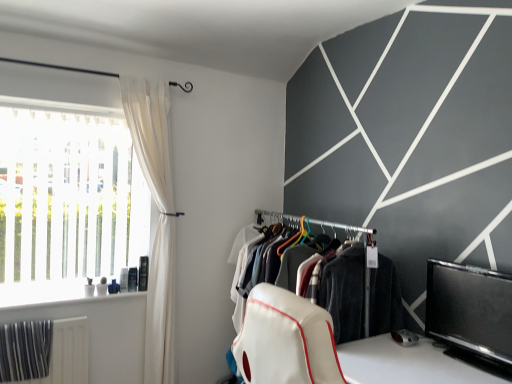
The height and width of the screenshot is (384, 512). Describe the element at coordinates (355, 285) in the screenshot. I see `white fabric clothes at center` at that location.

At what (x,y) coordinates should I click in order to perform the action: click on white translucent blinds at left. Please return your answer as a coordinate pair (x, y). This screenshot has width=512, height=384. Looking at the image, I should click on (67, 200).

At what (x,y) coordinates should I click in order to perform the action: click on black glossy tv at lower right. Please return your answer as a coordinate pair (x, y). The image size is (512, 384). Looking at the image, I should click on (470, 311).

Where is `white fabric clothes at center`? The width and height of the screenshot is (512, 384). white fabric clothes at center is located at coordinates (355, 285).

Is metallic silver radiator at lower left oriented away from white translucent blinds at left?

No, metallic silver radiator at lower left is not facing away from white translucent blinds at left.

From a real-world perspective, which is physically below, metallic silver radiator at lower left or white translucent blinds at left?

metallic silver radiator at lower left, from a real-world perspective.

Would you say metallic silver radiator at lower left is inside or outside white translucent blinds at left?

The correct answer is: outside.

Is white translucent blinds at left facing away from metallic silver radiator at lower left?

white translucent blinds at left does not have its back to metallic silver radiator at lower left.

Are white translucent blinds at left and metallic silver radiator at lower left far apart?

white translucent blinds at left is near metallic silver radiator at lower left, not far away.

Considering the sizes of objects white translucent blinds at left and metallic silver radiator at lower left in the image provided, who is smaller, white translucent blinds at left or metallic silver radiator at lower left?

Smaller between the two is metallic silver radiator at lower left.

Is white translucent blinds at left taller or shorter than white sheer curtain at left?

Clearly, white translucent blinds at left is shorter compared to white sheer curtain at left.

Is white translucent blinds at left oriented away from white sheer curtain at left?

That's not correct — white translucent blinds at left is not looking away from white sheer curtain at left.

Identify the location of curtain that appears below the white translucent blinds at left (from a real-world perspective). This screenshot has width=512, height=384. (158, 219).

Can you tell me how much white translucent blinds at left and white sheer curtain at left differ in facing direction?

1.3 degrees separate the facing orientations of white translucent blinds at left and white sheer curtain at left.

How many degrees apart are the facing directions of black glossy tv at lower right and metallic silver radiator at lower left?

black glossy tv at lower right and metallic silver radiator at lower left are facing 91.7 degrees away from each other.

From the image's perspective, which is above, black glossy tv at lower right or metallic silver radiator at lower left?

black glossy tv at lower right.

Between black glossy tv at lower right and metallic silver radiator at lower left, which one is positioned in front?

Positioned in front is black glossy tv at lower right.

Is point (493, 355) farther from camera compared to point (66, 322)?

No, (493, 355) is in front of (66, 322).

Is point (340, 328) in front of point (59, 341)?

Yes, it is in front of point (59, 341).

Does white fabric clothes at center lie in front of metallic silver radiator at lower left?

Yes.

The width and height of the screenshot is (512, 384). I want to click on radiator located below the white fabric clothes at center (from the image's perspective), so click(x=68, y=353).

Measure the distance from black glossy tv at lower right to white fabric clothes at center.

black glossy tv at lower right is 12.51 inches from white fabric clothes at center.

Locate an element on the screen. window screen above the white fabric clothes at center (from a real-world perspective) is located at coordinates (470, 311).

Looking at this image, is black glossy tv at lower right wider than white fabric clothes at center?

No, black glossy tv at lower right is not wider than white fabric clothes at center.

From the image's perspective, would you say black glossy tv at lower right is positioned over white fabric clothes at center?

Indeed, from the image's perspective, black glossy tv at lower right is shown above white fabric clothes at center.

Find the location of a particular element. closet below the white translucent blinds at left (from the image's perspective) is located at coordinates (355, 285).

Does white translucent blinds at left have a greater height compared to white fabric clothes at center?

No, white translucent blinds at left is not taller than white fabric clothes at center.

From the picture: How far apart are white translucent blinds at left and white fabric clothes at center?

white translucent blinds at left is 1.39 meters away from white fabric clothes at center.

How different are the orientations of white translucent blinds at left and white fabric clothes at center in degrees?

The angular difference between white translucent blinds at left and white fabric clothes at center is 88.6 degrees.

Image resolution: width=512 pixels, height=384 pixels. In order to click on radiator located in front of the white translucent blinds at left in this screenshot , I will do tap(68, 353).

At what (x,y) coordinates should I click in order to perform the action: click on radiator on the left of white translucent blinds at left. Please return your answer as a coordinate pair (x, y). This screenshot has height=384, width=512. Looking at the image, I should click on (68, 353).

Based on their spatial positions, is white fabric clothes at center or white translucent blinds at left closer to white sheer curtain at left?

white translucent blinds at left.

When comparing their distances from white fabric clothes at center, does white translucent blinds at left or white sheer curtain at left seem closer?

white sheer curtain at left.

Based on their spatial positions, is metallic silver radiator at lower left or black glossy tv at lower right closer to white fabric clothes at center?

The object closer to white fabric clothes at center is black glossy tv at lower right.

Based on their spatial positions, is black glossy tv at lower right or white sheer curtain at left closer to white fabric clothes at center?

Based on the image, black glossy tv at lower right appears to be nearer to white fabric clothes at center.

When comparing their distances from white fabric clothes at center, does white sheer curtain at left or white translucent blinds at left seem closer?

The object closer to white fabric clothes at center is white sheer curtain at left.

Based on their spatial positions, is white sheer curtain at left or black glossy tv at lower right further from white fabric clothes at center?

Among the two, white sheer curtain at left is located further to white fabric clothes at center.

When comparing their distances from metallic silver radiator at lower left, does black glossy tv at lower right or white translucent blinds at left seem further?

The object further to metallic silver radiator at lower left is black glossy tv at lower right.

From the image, which object appears to be farther from metallic silver radiator at lower left, white sheer curtain at left or white translucent blinds at left?

The object further to metallic silver radiator at lower left is white translucent blinds at left.

At what (x,y) coordinates should I click in order to perform the action: click on closet between metallic silver radiator at lower left and black glossy tv at lower right. Please return your answer as a coordinate pair (x, y). The width and height of the screenshot is (512, 384). Looking at the image, I should click on point(355,285).

Find the location of a particular element. window located between metallic silver radiator at lower left and black glossy tv at lower right in the left-right direction is located at coordinates (67, 200).

Where is `closet located between white translucent blinds at left and black glossy tv at lower right in the left-right direction`? The width and height of the screenshot is (512, 384). closet located between white translucent blinds at left and black glossy tv at lower right in the left-right direction is located at coordinates (355, 285).

I want to click on curtain located between metallic silver radiator at lower left and black glossy tv at lower right in the left-right direction, so click(158, 219).